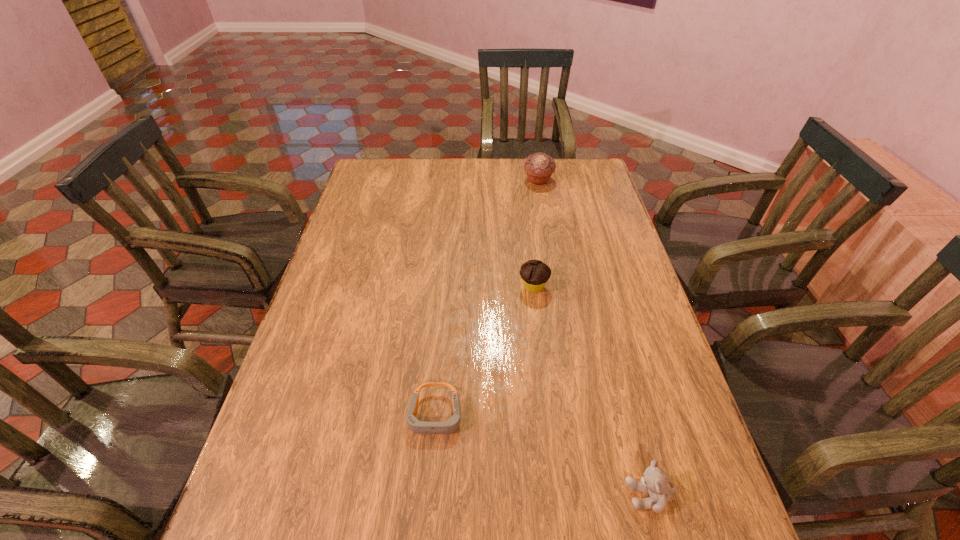
Locate an element on the screen. Image resolution: width=960 pixels, height=540 pixels. free space located 0.350m on the face of the nearest object is located at coordinates (446, 495).

Where is `vacant position located 0.130m on the face of the nearest object`? The height and width of the screenshot is (540, 960). vacant position located 0.130m on the face of the nearest object is located at coordinates (560, 495).

Where is `vacant space situated 0.100m on the back of the shorter muffin`? The image size is (960, 540). vacant space situated 0.100m on the back of the shorter muffin is located at coordinates (530, 254).

Locate an element on the screen. vacant space located on the front and back of the leftmost object is located at coordinates (425, 538).

Image resolution: width=960 pixels, height=540 pixels. In order to click on object located in the far edge section of the desktop in this screenshot , I will do `click(539, 167)`.

The height and width of the screenshot is (540, 960). I want to click on object that is positioned at the right edge, so click(x=654, y=482).

In the image, there is a desktop. Find the location of `free space at the far edge`. free space at the far edge is located at coordinates [469, 173].

Where is `vacant area at the left edge of the desktop`? vacant area at the left edge of the desktop is located at coordinates (299, 347).

Image resolution: width=960 pixels, height=540 pixels. What are the coordinates of `vacant space at the right edge` in the screenshot? It's located at (607, 375).

I want to click on free space between the nearest object and the shortest object, so click(542, 455).